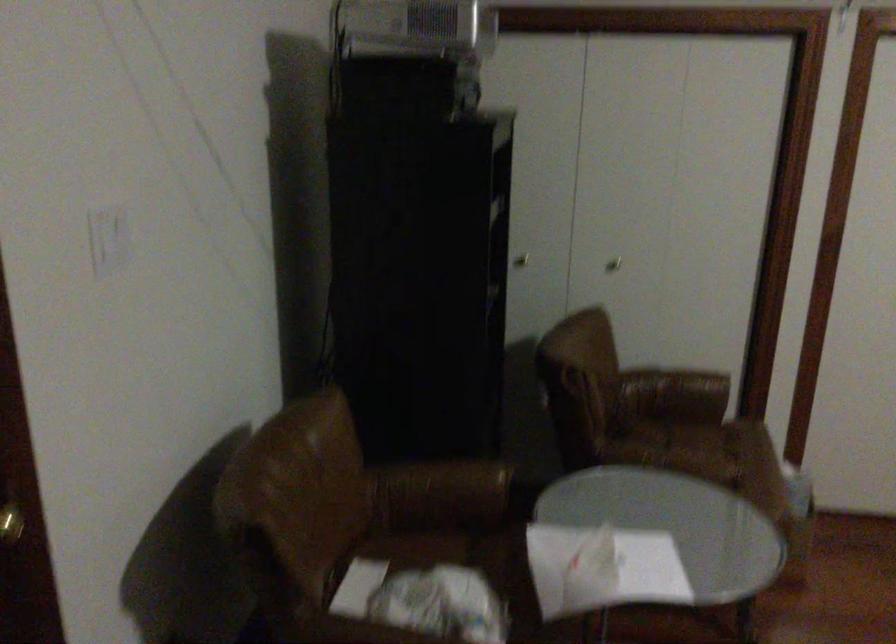
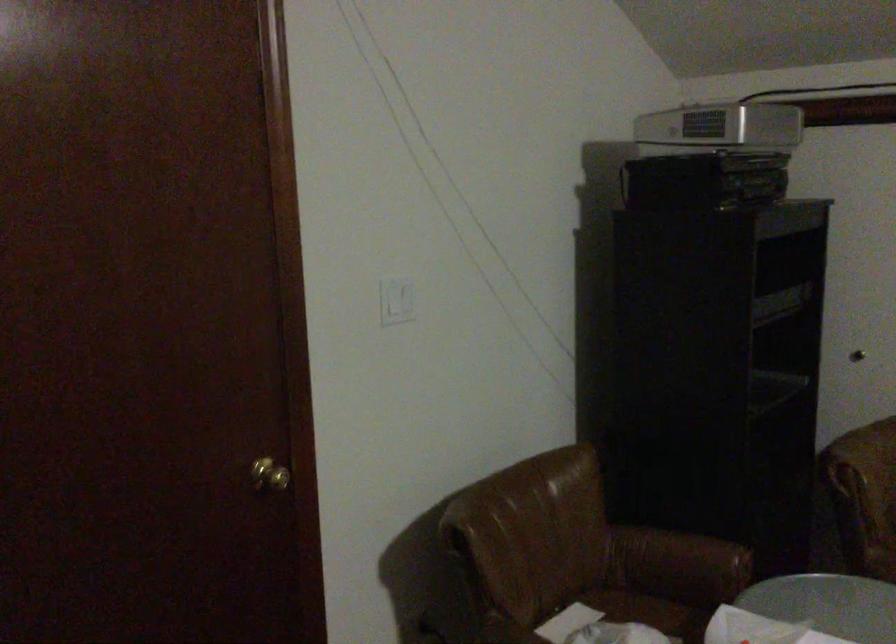
Question: The camera is either moving clockwise (left) or counter-clockwise (right) around the object. The first image is from the beginning of the video and the second image is from the end. Is the camera moving left or right when shooting the video?

Choices:
 (A) Left
 (B) Right

Answer: (B)